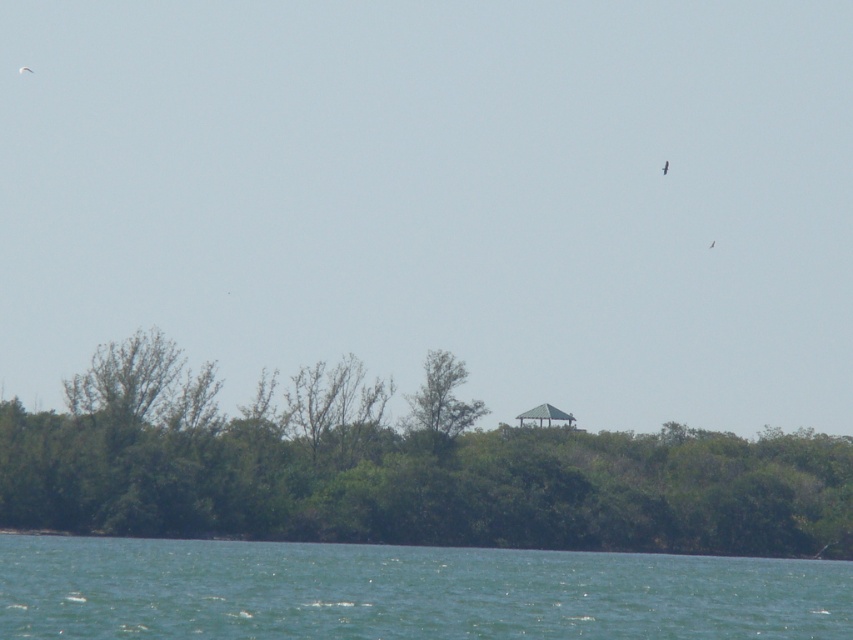
Question: Which object is positioned closest to the green leafy trees at center?

Choices:
 (A) green leafy tree at center
 (B) green water at lower center

Answer: (A)

Question: Which object appears closest to the camera in this image?

Choices:
 (A) green leafy tree at center
 (B) green leafy trees at center
 (C) green water at lower center

Answer: (C)

Question: Which point is farther from the camera taking this photo?

Choices:
 (A) (398, 445)
 (B) (318, 600)
 (C) (463, 369)

Answer: (C)

Question: Is green leafy trees at center wider than green water at lower center?

Choices:
 (A) no
 (B) yes

Answer: (B)

Question: Can you confirm if green leafy trees at center is wider than green leafy tree at center?

Choices:
 (A) yes
 (B) no

Answer: (A)

Question: Does green leafy trees at center appear under green water at lower center?

Choices:
 (A) no
 (B) yes

Answer: (A)